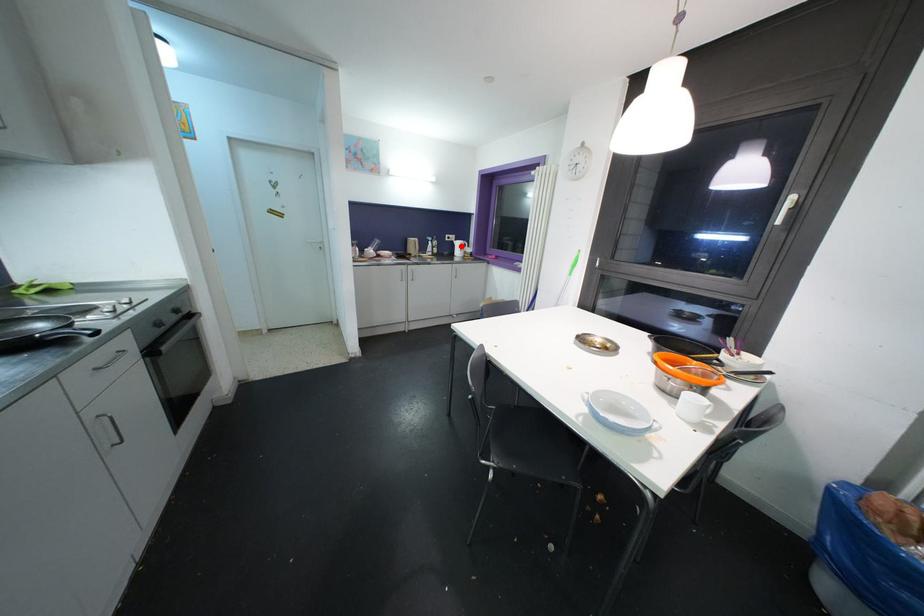
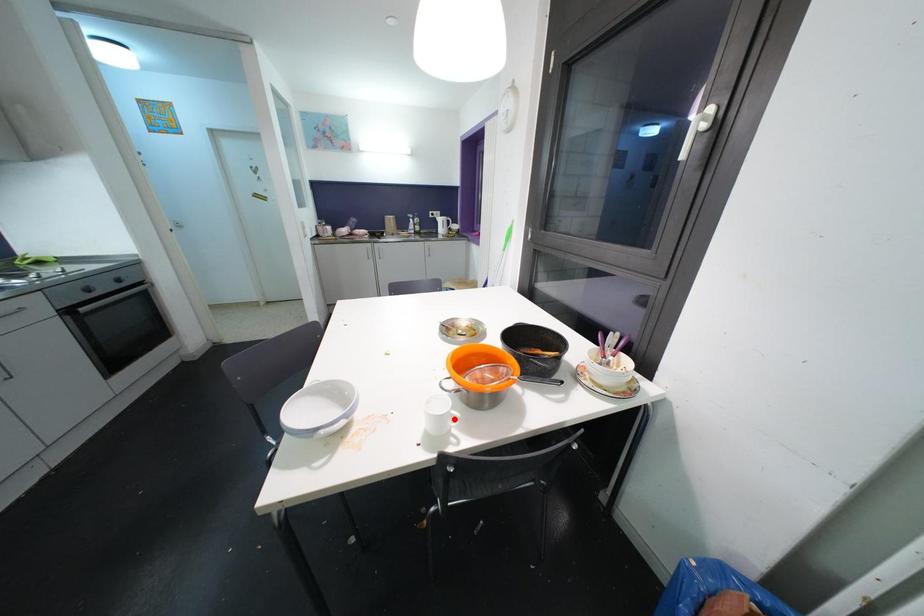
I am providing you with two images of the same scene from different viewpoints. A red point is marked on the first image and another point is marked on the second image. Does the point marked in image1 correspond to the same location as the one in image2?

No